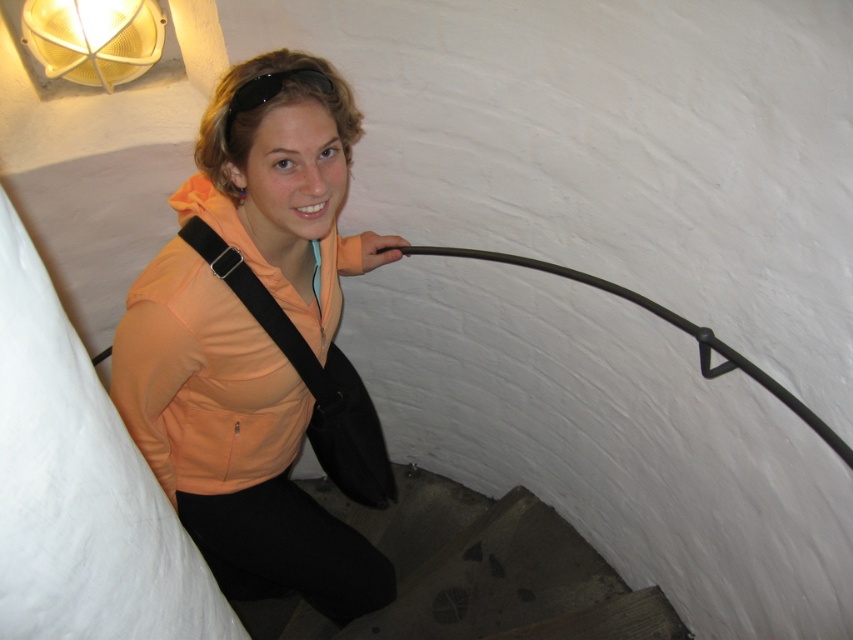
Which is in front, point (334, 316) or point (86, 77)?

Point (334, 316) is in front.

Can you confirm if orange fabric jacket at center is shorter than matte yellow mesh at upper left?

In fact, orange fabric jacket at center may be taller than matte yellow mesh at upper left.

Who is more forward, (341,157) or (94,80)?

Positioned in front is point (341,157).

Identify the location of orange fabric jacket at center. (260, 342).

Does orange fabric jacket at center have a lesser height compared to dark brown wooden stairs at lower center?

No.

Between orange fabric jacket at center and dark brown wooden stairs at lower center, which one appears on the right side from the viewer's perspective?

dark brown wooden stairs at lower center

At what (x,y) coordinates should I click in order to perform the action: click on orange fabric jacket at center. Please return your answer as a coordinate pair (x, y). Looking at the image, I should click on (260, 342).

Between dark brown wooden stairs at lower center and matte yellow mesh at upper left, which one appears on the right side from the viewer's perspective?

Positioned to the right is dark brown wooden stairs at lower center.

The height and width of the screenshot is (640, 853). What do you see at coordinates (486, 572) in the screenshot?
I see `dark brown wooden stairs at lower center` at bounding box center [486, 572].

You are a GUI agent. You are given a task and a screenshot of the screen. Output one action in this format:
    pyautogui.click(x=<x>, y=<y>)
    Task: Click on the dark brown wooden stairs at lower center
    The height and width of the screenshot is (640, 853).
    Given the screenshot: What is the action you would take?
    pyautogui.click(x=486, y=572)